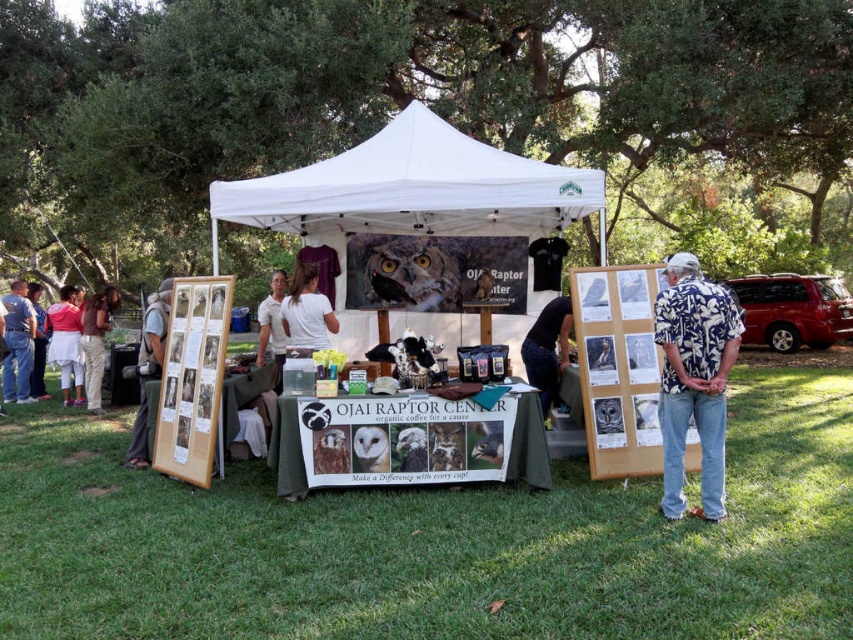
Which is behind, point (579, 547) or point (395, 125)?

The point (395, 125) is behind.

Where is `green grass at lower center`? green grass at lower center is located at coordinates (x=434, y=541).

Does white t-shirt at center come behind denim jeans at left?

That is False.

Is point (311, 269) positioned before point (26, 312)?

Yes, it is in front of point (26, 312).

Which is in front, point (291, 308) or point (13, 394)?

Positioned in front is point (291, 308).

Find the location of a particular element. This screenshot has height=640, width=853. white t-shirt at center is located at coordinates (306, 310).

Which is more to the left, white fabric canopy at center or dark blue shirt at center?

white fabric canopy at center is more to the left.

Is point (480, 157) positioned in front of point (543, 320)?

Yes, it is in front of point (543, 320).

Is point (582, 170) closer to viewer compared to point (558, 337)?

Yes.

Find the location of a particular element. The height and width of the screenshot is (640, 853). white fabric canopy at center is located at coordinates [415, 188].